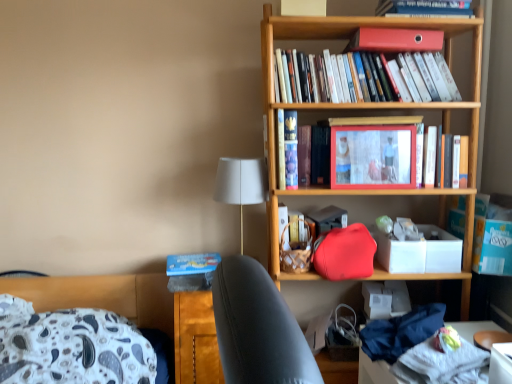
Identify the location of blank space situated above hardcover books at upper center, marked as the third book in a bottom-to-top arrangement (from a real-world perspective). (352, 44).